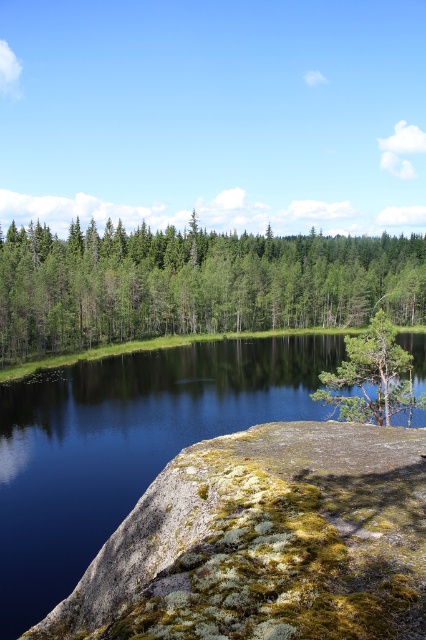
You are standing at the edge of the rocky outcrop covered with green moss in the foreground. You see a point labeled as point (123, 445). What is the location of this point relative to the smooth dark water at center?

The point (123, 445) corresponds to the smooth dark water at center, so it is located at the center of the water.

You are standing on the rocky outcrop in the foreground and want to walk to the edge of the smooth dark water at center. Is the green textured tree at center blocking your path?

The smooth dark water at center is positioned under the green textured tree at center, so the tree is blocking your path to the water.

You are standing at the edge of the lake in the serene landscape and want to walk towards the two points marked in the image. Which point, point (x=138, y=269) or point (x=359, y=406), will you reach first?

You will reach point (x=138, y=269) first because it is closer to you than point (x=359, y=406), which is further away.